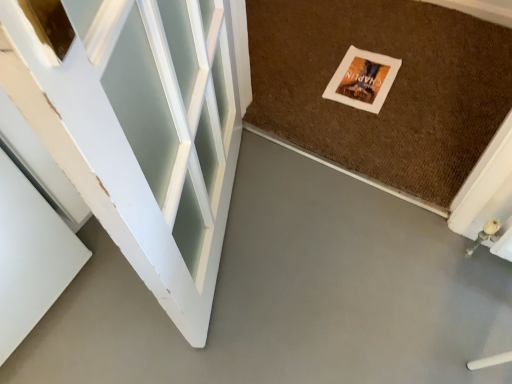
Question: Considering the relative positions of gray smooth concrete at center and brown textured mat at center in the image provided, is gray smooth concrete at center in front of brown textured mat at center?

Choices:
 (A) no
 (B) yes

Answer: (B)

Question: Would you say brown textured mat at center is part of gray smooth concrete at center's contents?

Choices:
 (A) yes
 (B) no

Answer: (B)

Question: Can you confirm if gray smooth concrete at center is wider than brown textured mat at center?

Choices:
 (A) no
 (B) yes

Answer: (A)

Question: From a real-world perspective, is gray smooth concrete at center located beneath brown textured mat at center?

Choices:
 (A) no
 (B) yes

Answer: (B)

Question: Does gray smooth concrete at center turn towards brown textured mat at center?

Choices:
 (A) yes
 (B) no

Answer: (A)

Question: Does gray smooth concrete at center have a lesser width compared to brown textured mat at center?

Choices:
 (A) yes
 (B) no

Answer: (A)

Question: Does brown textured mat at center have a lesser width compared to matte paper postcard at center?

Choices:
 (A) no
 (B) yes

Answer: (A)

Question: Is brown textured mat at center positioned beyond the bounds of matte paper postcard at center?

Choices:
 (A) no
 (B) yes

Answer: (B)

Question: Does brown textured mat at center have a larger size compared to matte paper postcard at center?

Choices:
 (A) no
 (B) yes

Answer: (B)

Question: Would you say matte paper postcard at center is part of brown textured mat at center's contents?

Choices:
 (A) yes
 (B) no

Answer: (A)

Question: From a real-world perspective, is brown textured mat at center positioned over matte paper postcard at center based on gravity?

Choices:
 (A) no
 (B) yes

Answer: (A)

Question: Is brown textured mat at center not close to matte paper postcard at center?

Choices:
 (A) no
 (B) yes

Answer: (A)

Question: Is matte paper postcard at center shorter than brown textured mat at center?

Choices:
 (A) yes
 (B) no

Answer: (A)